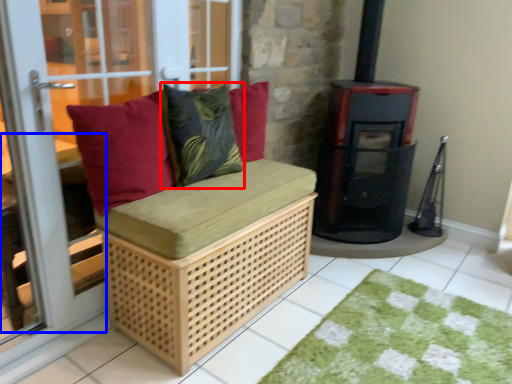
Question: Which object appears farthest to the camera in this image, throw pillow (highlighted by a red box) or table (highlighted by a blue box)?

Choices:
 (A) throw pillow
 (B) table

Answer: (A)